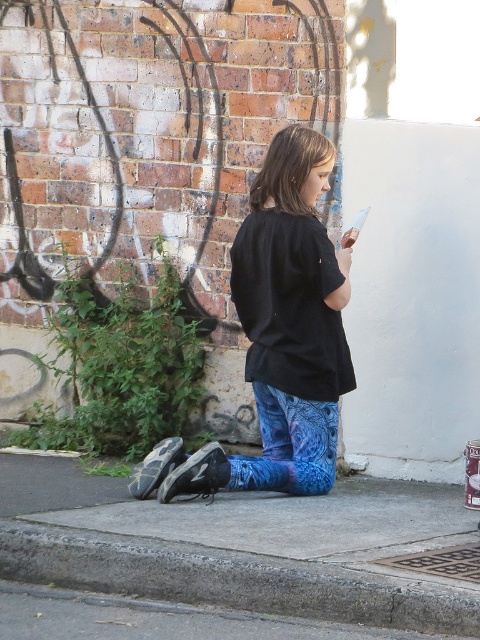
Who is lower down, black cotton shirt at center or blue printed leggings at lower center?

Positioned lower is blue printed leggings at lower center.

Looking at this image, who is more forward, (320, 150) or (321, 416)?

Point (320, 150) is in front.

The image size is (480, 640). In order to click on black cotton shirt at center in this screenshot , I will do [278, 337].

Consider the image. Between gray concrete curb at lower left and blue printed leggings at lower center, which one has more height?

blue printed leggings at lower center is taller.

Does gray concrete curb at lower left have a smaller size compared to blue printed leggings at lower center?

No, gray concrete curb at lower left is not smaller than blue printed leggings at lower center.

Between point (294, 611) and point (323, 444), which one is positioned behind?

Point (323, 444)

Locate an element on the screen. This screenshot has height=640, width=480. gray concrete curb at lower left is located at coordinates click(229, 579).

Between black cotton shirt at center and gray concrete curb at lower left, which one is positioned higher?

black cotton shirt at center is above.

Who is more forward, [299,198] or [216,550]?

Result: Positioned in front is point [216,550].

Which is in front, point (279, 364) or point (48, 570)?

Point (48, 570)

Identify the location of black cotton shirt at center. The image size is (480, 640). (278, 337).